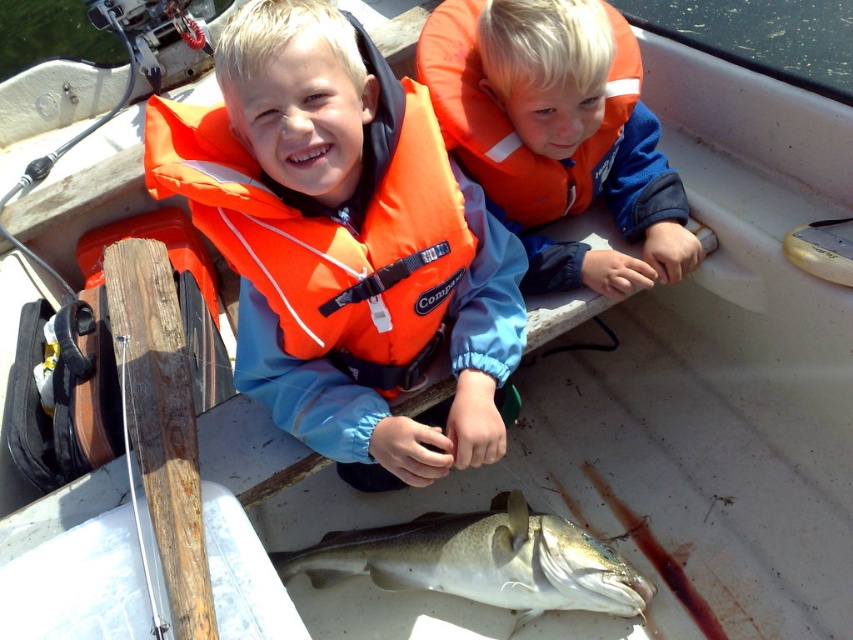
Question: Based on their relative distances, which object is nearer to the speckled white fish at center?

Choices:
 (A) orange life vest at center
 (B) orange life jacket at upper center

Answer: (A)

Question: Which point is farther to the camera?

Choices:
 (A) (346, 36)
 (B) (421, 576)

Answer: (B)

Question: Does orange life vest at center appear on the right side of orange life jacket at upper center?

Choices:
 (A) no
 (B) yes

Answer: (A)

Question: Which object appears farthest from the camera in this image?

Choices:
 (A) orange life jacket at upper center
 (B) speckled white fish at center

Answer: (B)

Question: Is orange life vest at center smaller than orange life jacket at upper center?

Choices:
 (A) no
 (B) yes

Answer: (A)

Question: Does orange life vest at center come behind orange life jacket at upper center?

Choices:
 (A) no
 (B) yes

Answer: (A)